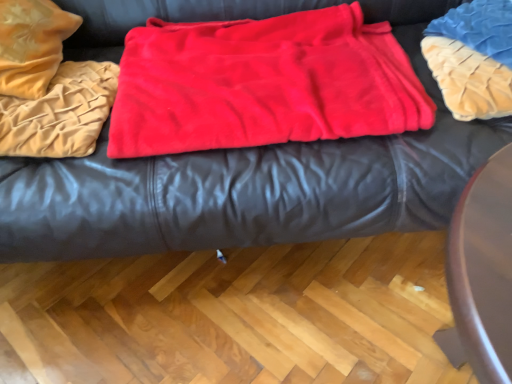
The height and width of the screenshot is (384, 512). What do you see at coordinates (60, 113) in the screenshot?
I see `velvet beige blanket at left, the 1th blanket in the left-to-right sequence` at bounding box center [60, 113].

The height and width of the screenshot is (384, 512). Describe the element at coordinates (251, 182) in the screenshot. I see `velvet-like red blanket at center` at that location.

I want to click on velvet-like red blanket at center, so click(251, 182).

The height and width of the screenshot is (384, 512). I want to click on red fleece blanket at center, marked as the 1th blanket in a right-to-left arrangement, so click(263, 83).

Is blue textured pillow at upper right completely or partially outside of velvet beige blanket at left, placed as the second blanket when sorted from right to left?

Yes, blue textured pillow at upper right is outside of velvet beige blanket at left, placed as the second blanket when sorted from right to left.

Considering the sizes of objects blue textured pillow at upper right and velvet beige blanket at left, placed as the second blanket when sorted from right to left, in the image provided, who is wider, blue textured pillow at upper right or velvet beige blanket at left, placed as the second blanket when sorted from right to left,?

blue textured pillow at upper right is wider.

Does blue textured pillow at upper right appear on the left side of velvet beige blanket at left, placed as the second blanket when sorted from right to left?

In fact, blue textured pillow at upper right is to the right of velvet beige blanket at left, placed as the second blanket when sorted from right to left.

Is blue textured pillow at upper right oriented towards velvet beige blanket at left, placed as the second blanket when sorted from right to left?

No, blue textured pillow at upper right is not oriented towards velvet beige blanket at left, placed as the second blanket when sorted from right to left.

Is the surface of velvet beige blanket at left, placed as the second blanket when sorted from right to left, in direct contact with red fleece blanket at center, which is the second blanket from left to right?

No, velvet beige blanket at left, placed as the second blanket when sorted from right to left, is not with red fleece blanket at center, which is the second blanket from left to right.

From a real-world perspective, is velvet beige blanket at left, the 1th blanket in the left-to-right sequence, positioned above or below red fleece blanket at center, marked as the 1th blanket in a right-to-left arrangement?

From a real-world perspective, velvet beige blanket at left, the 1th blanket in the left-to-right sequence, is physically above red fleece blanket at center, marked as the 1th blanket in a right-to-left arrangement.

Which is closer to the camera, (49,129) or (307,20)?

Point (49,129) appears to be closer to the viewer than point (307,20).

Can you confirm if velvet beige blanket at left, placed as the second blanket when sorted from right to left, is thinner than red fleece blanket at center, marked as the 1th blanket in a right-to-left arrangement?

Yes.

Which object is positioned more to the right, red fleece blanket at center, which is the second blanket from left to right, or blue textured pillow at upper right?

blue textured pillow at upper right.

Is red fleece blanket at center, marked as the 1th blanket in a right-to-left arrangement, far away from blue textured pillow at upper right?

That's not correct — red fleece blanket at center, marked as the 1th blanket in a right-to-left arrangement, is a little close to blue textured pillow at upper right.

Is red fleece blanket at center, marked as the 1th blanket in a right-to-left arrangement, further to camera compared to blue textured pillow at upper right?

Yes, it is behind blue textured pillow at upper right.

Which is in front, point (399, 46) or point (472, 116)?

Point (472, 116)

Is blue textured pillow at upper right outside of velvet-like red blanket at center?

Actually, blue textured pillow at upper right is at least partially inside velvet-like red blanket at center.

From a real-world perspective, between blue textured pillow at upper right and velvet-like red blanket at center, who is vertically lower?

velvet-like red blanket at center, from a real-world perspective.

From the image's perspective, which is below, blue textured pillow at upper right or velvet-like red blanket at center?

blue textured pillow at upper right is shown below in the image.

What's the angular difference between blue textured pillow at upper right and velvet-like red blanket at center's facing directions?

They differ by 0.000126 degrees in their facing directions.

Locate an element on the screen. furniture that appears above the red fleece blanket at center, marked as the 1th blanket in a right-to-left arrangement (from the image's perspective) is located at coordinates (251, 182).

Between point (285, 124) and point (369, 150), which one is positioned behind?

Point (285, 124)

Based on their positions, is red fleece blanket at center, which is the second blanket from left to right, located to the left or right of velvet-like red blanket at center?

Answer: Clearly, red fleece blanket at center, which is the second blanket from left to right, is on the right of velvet-like red blanket at center in the image.

From a real-world perspective, which is physically below, velvet beige blanket at left, placed as the second blanket when sorted from right to left, or blue textured pillow at upper right?

velvet beige blanket at left, placed as the second blanket when sorted from right to left.

In the scene shown: How much distance is there between velvet beige blanket at left, placed as the second blanket when sorted from right to left, and blue textured pillow at upper right?

velvet beige blanket at left, placed as the second blanket when sorted from right to left, and blue textured pillow at upper right are 32.63 inches apart from each other.

From the image's perspective, would you say velvet beige blanket at left, placed as the second blanket when sorted from right to left, is positioned over blue textured pillow at upper right?

No.

In the scene shown: Is there a large distance between velvet beige blanket at left, the 1th blanket in the left-to-right sequence, and velvet-like red blanket at center?

No, there isn't a large distance between velvet beige blanket at left, the 1th blanket in the left-to-right sequence, and velvet-like red blanket at center.

Does velvet beige blanket at left, the 1th blanket in the left-to-right sequence, have a greater width compared to velvet-like red blanket at center?

In fact, velvet beige blanket at left, the 1th blanket in the left-to-right sequence, might be narrower than velvet-like red blanket at center.

Between velvet beige blanket at left, the 1th blanket in the left-to-right sequence, and velvet-like red blanket at center, which one has larger size?

velvet-like red blanket at center.

Which is more to the left, velvet beige blanket at left, the 1th blanket in the left-to-right sequence, or velvet-like red blanket at center?

velvet beige blanket at left, the 1th blanket in the left-to-right sequence.

This screenshot has width=512, height=384. I want to click on the 2nd blanket to the left when counting from the blue textured pillow at upper right, so click(x=60, y=113).

Where is `blanket below the red fleece blanket at center, which is the second blanket from left to right (from the image's perspective)`? This screenshot has width=512, height=384. blanket below the red fleece blanket at center, which is the second blanket from left to right (from the image's perspective) is located at coordinates (60, 113).

From the image, which object appears to be nearer to velvet-like red blanket at center, red fleece blanket at center, marked as the 1th blanket in a right-to-left arrangement, or velvet beige blanket at left, placed as the second blanket when sorted from right to left?

Based on the image, red fleece blanket at center, marked as the 1th blanket in a right-to-left arrangement, appears to be nearer to velvet-like red blanket at center.

When comparing their distances from velvet beige blanket at left, the 1th blanket in the left-to-right sequence, does velvet-like red blanket at center or blue textured pillow at upper right seem further?

The object further to velvet beige blanket at left, the 1th blanket in the left-to-right sequence, is blue textured pillow at upper right.

Based on their spatial positions, is blue textured pillow at upper right or velvet-like red blanket at center further from red fleece blanket at center, which is the second blanket from left to right?

blue textured pillow at upper right is positioned further to the anchor red fleece blanket at center, which is the second blanket from left to right.

Considering their positions, is red fleece blanket at center, marked as the 1th blanket in a right-to-left arrangement, positioned closer to velvet beige blanket at left, the 1th blanket in the left-to-right sequence, than velvet-like red blanket at center?

velvet-like red blanket at center lies closer to velvet beige blanket at left, the 1th blanket in the left-to-right sequence, than the other object.

Looking at the image, which one is located further to velvet-like red blanket at center, velvet beige blanket at left, placed as the second blanket when sorted from right to left, or red fleece blanket at center, marked as the 1th blanket in a right-to-left arrangement?

velvet beige blanket at left, placed as the second blanket when sorted from right to left, is positioned further to the anchor velvet-like red blanket at center.

Which object lies nearer to the anchor point velvet-like red blanket at center, red fleece blanket at center, marked as the 1th blanket in a right-to-left arrangement, or blue textured pillow at upper right?

Among the two, red fleece blanket at center, marked as the 1th blanket in a right-to-left arrangement, is located nearer to velvet-like red blanket at center.

From the image, which object appears to be nearer to blue textured pillow at upper right, velvet-like red blanket at center or red fleece blanket at center, which is the second blanket from left to right?

velvet-like red blanket at center.

Consider the image. Looking at the image, which one is located closer to red fleece blanket at center, marked as the 1th blanket in a right-to-left arrangement, velvet beige blanket at left, placed as the second blanket when sorted from right to left, or velvet-like red blanket at center?

Among the two, velvet-like red blanket at center is located nearer to red fleece blanket at center, marked as the 1th blanket in a right-to-left arrangement.

Image resolution: width=512 pixels, height=384 pixels. What are the coordinates of `furniture situated between velvet beige blanket at left, the 1th blanket in the left-to-right sequence, and blue textured pillow at upper right from left to right` in the screenshot? It's located at 251,182.

This screenshot has height=384, width=512. What are the coordinates of `blanket between velvet beige blanket at left, placed as the second blanket when sorted from right to left, and blue textured pillow at upper right` in the screenshot? It's located at (263, 83).

The height and width of the screenshot is (384, 512). In order to click on furniture situated between velvet beige blanket at left, placed as the second blanket when sorted from right to left, and red fleece blanket at center, which is the second blanket from left to right, from left to right in this screenshot , I will do `click(251, 182)`.

Identify the location of blanket located between velvet-like red blanket at center and blue textured pillow at upper right in the left-right direction. point(263,83).